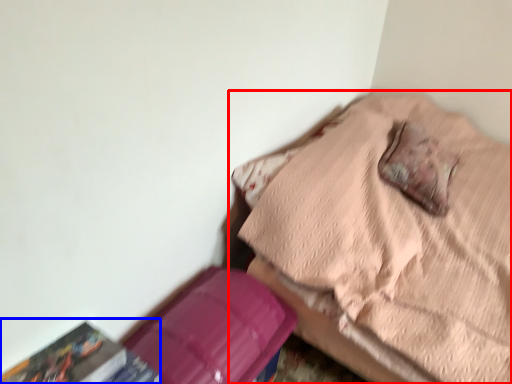
Question: Which point is closer to the camera, furniture (highlighted by a red box) or paperback book (highlighted by a blue box)?

Choices:
 (A) furniture
 (B) paperback book

Answer: (B)